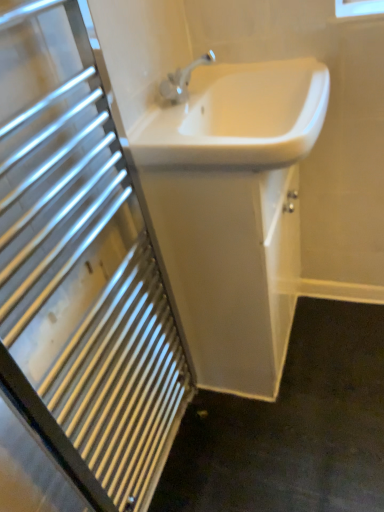
Question: Can you confirm if white glossy sink at center, which is the 2th sink from bottom to top, is positioned to the right of white glossy sink at upper center?

Choices:
 (A) no
 (B) yes

Answer: (B)

Question: Is white glossy sink at center, which is the 2th sink from bottom to top, outside of white glossy sink at upper center?

Choices:
 (A) yes
 (B) no

Answer: (A)

Question: Is white glossy sink at center, arranged as the first sink when viewed from the top, aimed at white glossy sink at upper center?

Choices:
 (A) yes
 (B) no

Answer: (B)

Question: From a real-world perspective, does white glossy sink at center, arranged as the first sink when viewed from the top, sit lower than white glossy sink at upper center?

Choices:
 (A) yes
 (B) no

Answer: (B)

Question: Does white glossy sink at center, which is the 2th sink from bottom to top, have a larger size compared to white glossy sink at upper center?

Choices:
 (A) yes
 (B) no

Answer: (B)

Question: From a real-world perspective, relative to white glossy sink at center, which appears as the 2th sink when viewed from the top, is white glossy sink at upper center vertically above or below?

Choices:
 (A) below
 (B) above

Answer: (B)

Question: Based on their sizes in the image, would you say white glossy sink at upper center is bigger or smaller than white glossy sink at center, which appears as the 2th sink when viewed from the top?

Choices:
 (A) small
 (B) big

Answer: (A)

Question: In terms of height, does white glossy sink at upper center look taller or shorter compared to white glossy sink at center, which appears as the 1th sink when ordered from the bottom?

Choices:
 (A) tall
 (B) short

Answer: (A)

Question: From the image's perspective, relative to white glossy sink at center, which appears as the 1th sink when ordered from the bottom, is white glossy sink at upper center above or below?

Choices:
 (A) below
 (B) above

Answer: (A)

Question: From the image's perspective, is white glossy sink at center, arranged as the first sink when viewed from the top, above or below white glossy sink at center, which appears as the 2th sink when viewed from the top?

Choices:
 (A) above
 (B) below

Answer: (A)

Question: Considering their positions, is white glossy sink at center, arranged as the first sink when viewed from the top, located in front of or behind white glossy sink at center, which appears as the 1th sink when ordered from the bottom?

Choices:
 (A) behind
 (B) front

Answer: (B)

Question: In terms of width, does white glossy sink at center, which is the 2th sink from bottom to top, look wider or thinner when compared to white glossy sink at center, which appears as the 1th sink when ordered from the bottom?

Choices:
 (A) thin
 (B) wide

Answer: (B)

Question: In terms of size, does white glossy sink at center, arranged as the first sink when viewed from the top, appear bigger or smaller than white glossy sink at center, which appears as the 1th sink when ordered from the bottom?

Choices:
 (A) small
 (B) big

Answer: (A)

Question: Is point (163, 163) positioned closer to the camera than point (165, 322)?

Choices:
 (A) farther
 (B) closer

Answer: (B)

Question: Looking at their shapes, would you say white glossy sink at center, which appears as the 1th sink when ordered from the bottom, is wider or thinner than white glossy sink at upper center?

Choices:
 (A) thin
 (B) wide

Answer: (B)